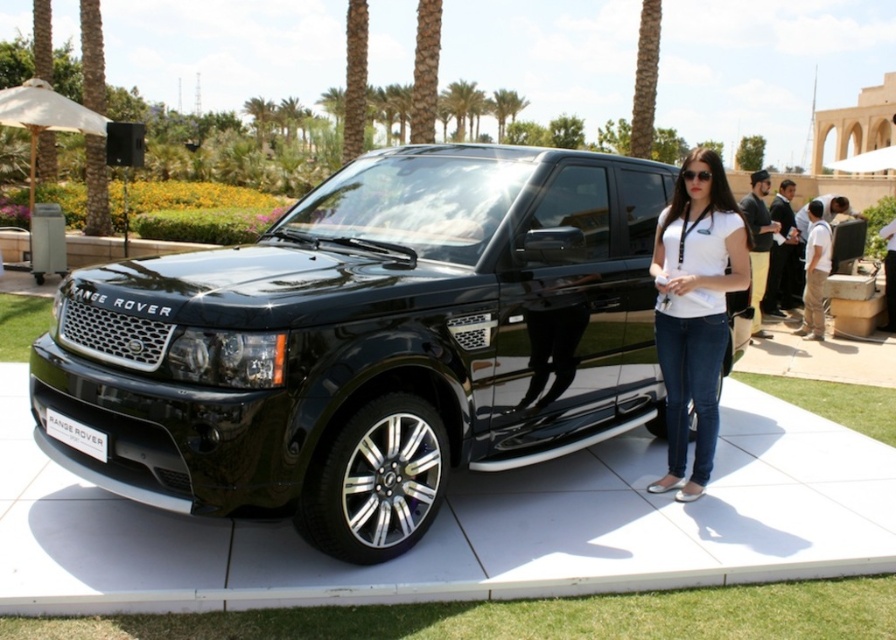
Which of these two, black metallic car at center or white matte shirt at center, stands shorter?

white matte shirt at center

Between black metallic car at center and white matte shirt at center, which one appears on the left side from the viewer's perspective?

Positioned to the left is black metallic car at center.

You are a GUI agent. You are given a task and a screenshot of the screen. Output one action in this format:
    pyautogui.click(x=<x>, y=<y>)
    Task: Click on the black metallic car at center
    The height and width of the screenshot is (640, 896).
    Given the screenshot: What is the action you would take?
    pyautogui.click(x=368, y=342)